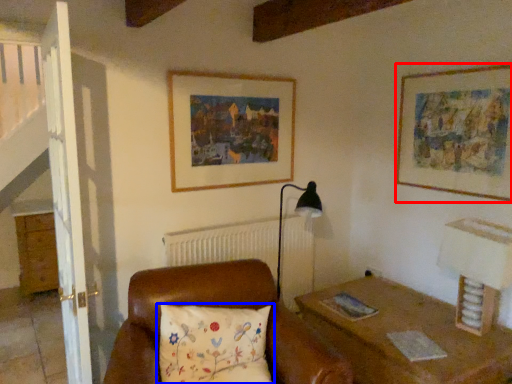
Question: Which object is closer to the camera taking this photo, picture frame (highlighted by a red box) or pillow (highlighted by a blue box)?

Choices:
 (A) picture frame
 (B) pillow

Answer: (B)